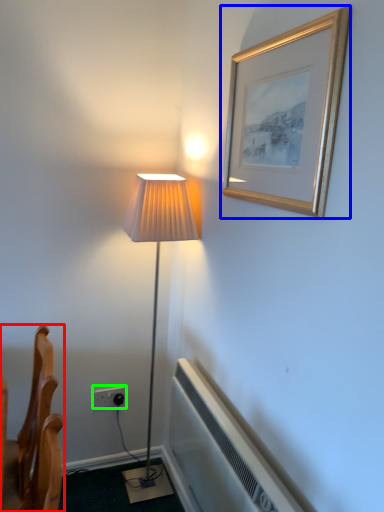
Question: Based on their relative distances, which object is farther from furniture (highlighted by a red box)? Choose from picture frame (highlighted by a blue box) and electric outlet (highlighted by a green box).

Choices:
 (A) picture frame
 (B) electric outlet

Answer: (A)